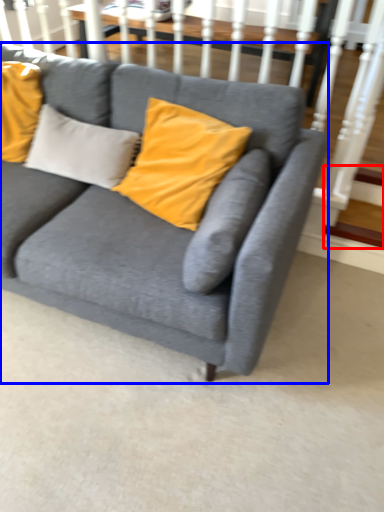
Question: Among these objects, which one is farthest to the camera, stairs (highlighted by a red box) or studio couch (highlighted by a blue box)?

Choices:
 (A) stairs
 (B) studio couch

Answer: (A)